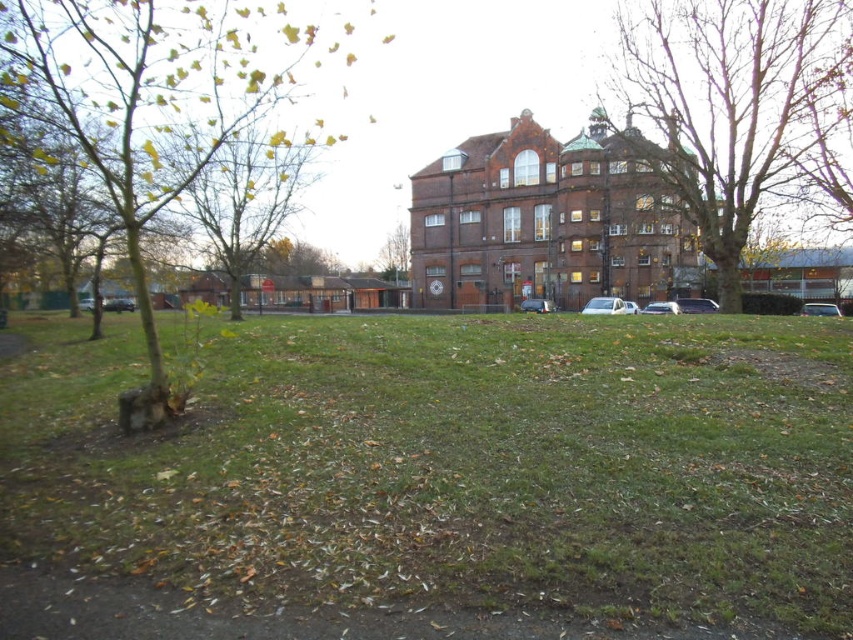
You are standing in front of the large brick building and notice two points marked in the scene. Which point, point (257,154) or point (708,308), is closer to you?

Point (257,154) is closer to the camera than point (708,308), so it is closer to you.